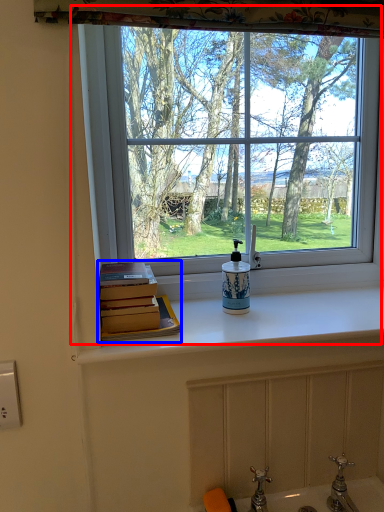
Question: Among these objects, which one is farthest to the camera, window (highlighted by a red box) or book (highlighted by a blue box)?

Choices:
 (A) window
 (B) book

Answer: (A)